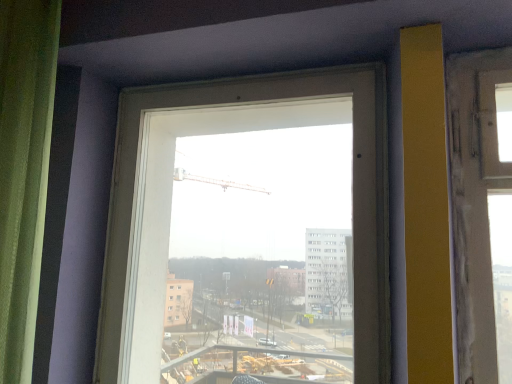
Describe the element at coordinates (353, 193) in the screenshot. I see `transparent glass window at center` at that location.

In order to face transparent glass window at center, should I rotate leftwards or rightwards?

Turn left approximately 2.623 degrees to face it.

Measure the distance between point (385, 357) and camera.

Point (385, 357) is 3.60 feet from camera.

You are a GUI agent. You are given a task and a screenshot of the screen. Output one action in this format:
    pyautogui.click(x=<x>, y=<y>)
    Task: Click on the transparent glass window at center
    
    Given the screenshot: What is the action you would take?
    pyautogui.click(x=353, y=193)

Locate an element on the screen. Image resolution: width=512 pixels, height=384 pixels. transparent glass window at center is located at coordinates (353, 193).